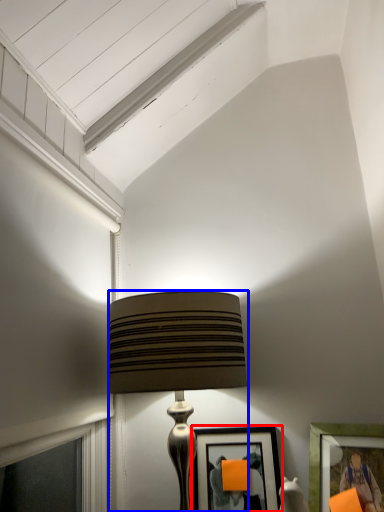
Question: Among these objects, which one is farthest to the camera, picture frame (highlighted by a red box) or lamp (highlighted by a blue box)?

Choices:
 (A) picture frame
 (B) lamp

Answer: (A)